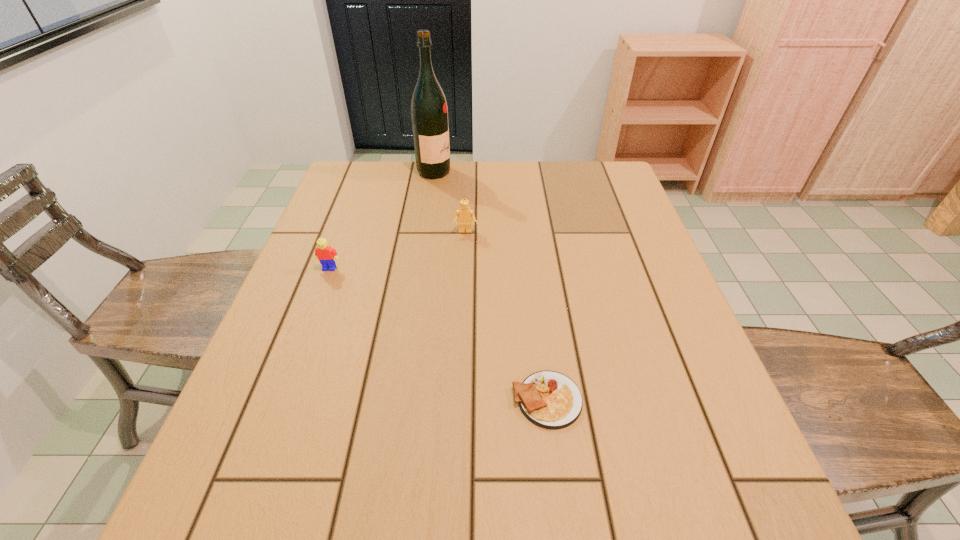
You are a GUI agent. You are given a task and a screenshot of the screen. Output one action in this format:
    pyautogui.click(x=<x>, y=<y>)
    Task: Click on the vacant space located 0.140m on the front-facing side of the leftmost object
    This screenshot has width=960, height=540.
    Given the screenshot: What is the action you would take?
    pyautogui.click(x=312, y=314)

You are a GUI agent. You are given a task and a screenshot of the screen. Output one action in this format:
    pyautogui.click(x=<x>, y=<y>)
    Task: Click on the free region located on the left of the shortest object
    The image size is (960, 540).
    Given the screenshot: What is the action you would take?
    pyautogui.click(x=296, y=400)

This screenshot has width=960, height=540. Find the location of `object that is at the far edge`. object that is at the far edge is located at coordinates (429, 113).

The height and width of the screenshot is (540, 960). I want to click on object located in the left edge section of the desktop, so click(326, 255).

Image resolution: width=960 pixels, height=540 pixels. I want to click on blank space at the near edge, so click(521, 484).

Locate an element on the screen. This screenshot has width=960, height=540. free space at the left edge of the desktop is located at coordinates (343, 210).

Locate an element on the screen. The width and height of the screenshot is (960, 540). vacant space at the right edge is located at coordinates (651, 325).

In the image, there is a desktop. Where is `vacant space at the far left corner`? The image size is (960, 540). vacant space at the far left corner is located at coordinates (385, 162).

Find the location of a particular element. The height and width of the screenshot is (540, 960). vacant space at the far right corner of the desktop is located at coordinates (x=609, y=179).

Find the location of a particular element. empty space that is in between the third nearest object and the rightmost object is located at coordinates (506, 316).